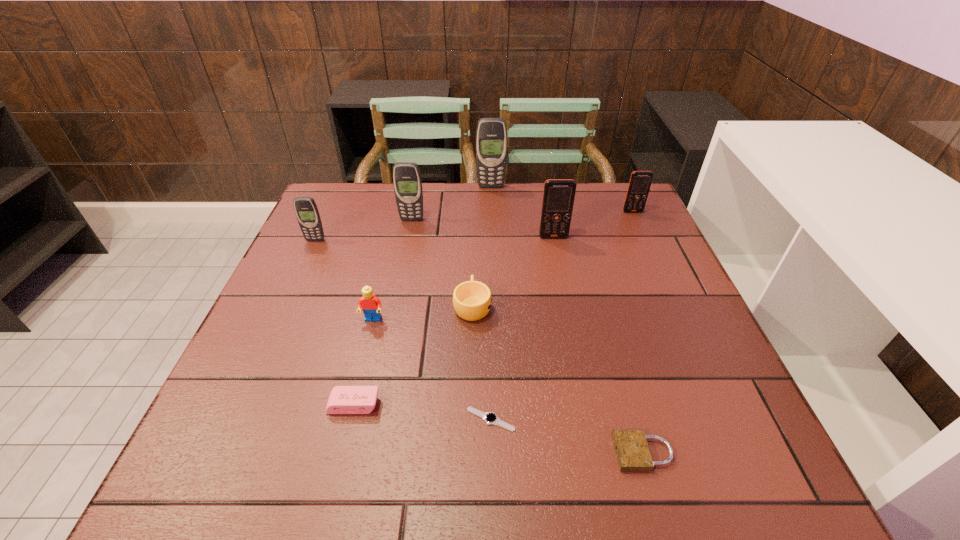
Where is `vacant space located 0.140m on the screen of the second gray cellular telephone from right to left`? The height and width of the screenshot is (540, 960). vacant space located 0.140m on the screen of the second gray cellular telephone from right to left is located at coordinates (405, 252).

The width and height of the screenshot is (960, 540). What are the coordinates of `vacant space situated on the screen of the bigger orange cellular telephone` in the screenshot? It's located at (563, 281).

You are a GUI agent. You are given a task and a screenshot of the screen. Output one action in this format:
    pyautogui.click(x=<x>, y=<y>)
    Task: Click on the vacant region located 0.390m on the screen of the second farthest cellular telephone
    Image resolution: width=960 pixels, height=540 pixels.
    Given the screenshot: What is the action you would take?
    pyautogui.click(x=677, y=308)

Locate an element on the screen. blank space located 0.240m on the screen of the leftmost cellular telephone is located at coordinates (286, 304).

At what (x,y) coordinates should I click in order to perform the action: click on vacant space located 0.280m on the face of the Lego. Please return your answer as a coordinate pair (x, y). Image resolution: width=960 pixels, height=540 pixels. Looking at the image, I should click on (343, 444).

What are the coordinates of `vacant area situated on the back of the beige cup` in the screenshot? It's located at (473, 252).

This screenshot has height=540, width=960. What are the coordinates of `vacant space located on the right of the eighth tallest object` in the screenshot? It's located at (522, 404).

Identify the location of vacant position located on the keyhole side of the second shortest object. (483, 453).

Locate an element on the screen. This screenshot has height=540, width=960. vacant space situated on the keyhole side of the second shortest object is located at coordinates (552, 453).

This screenshot has width=960, height=540. What are the coordinates of `vacant space situated 0.300m on the keyhole side of the second shortest object` in the screenshot? It's located at (442, 453).